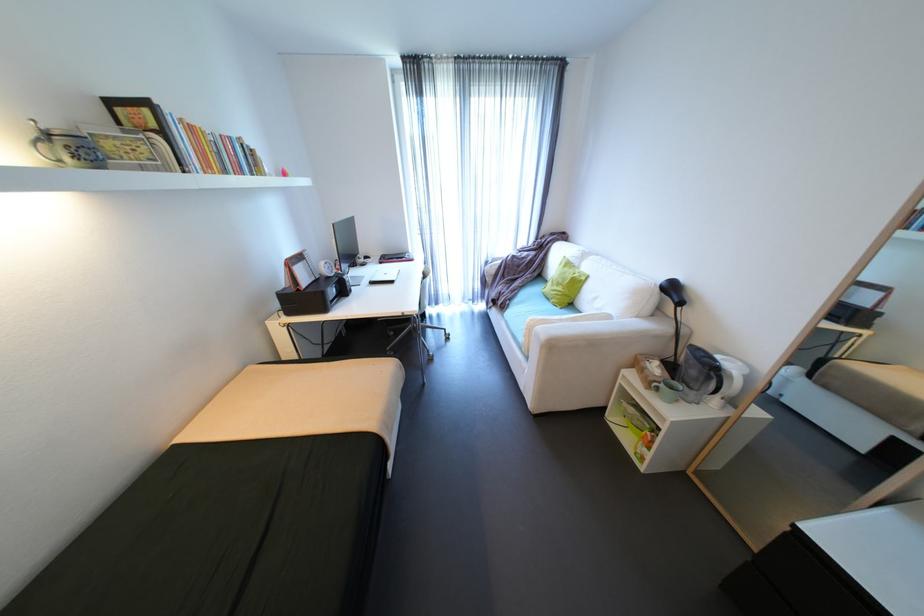
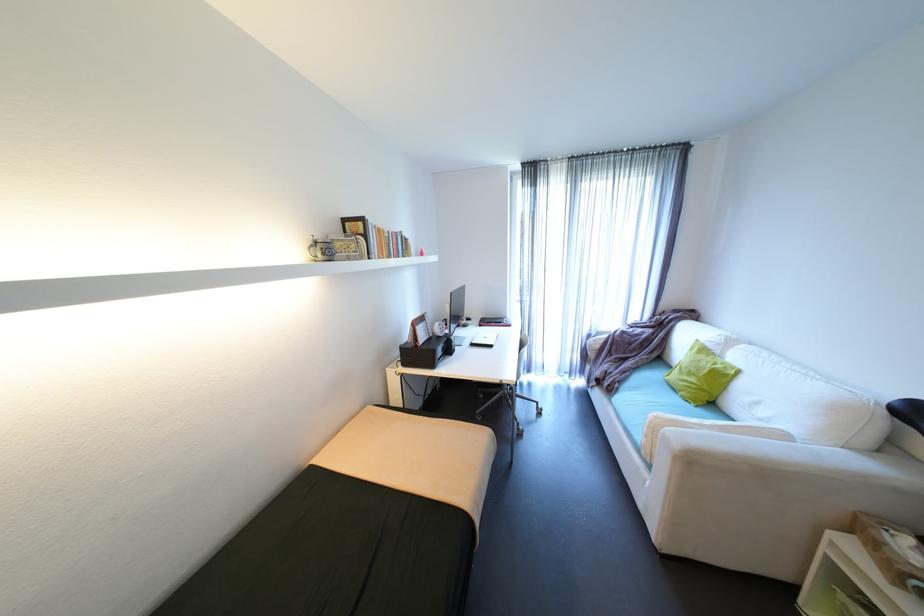
The point at (594, 277) is marked in the first image. Where is the corresponding point in the second image?

(747, 371)